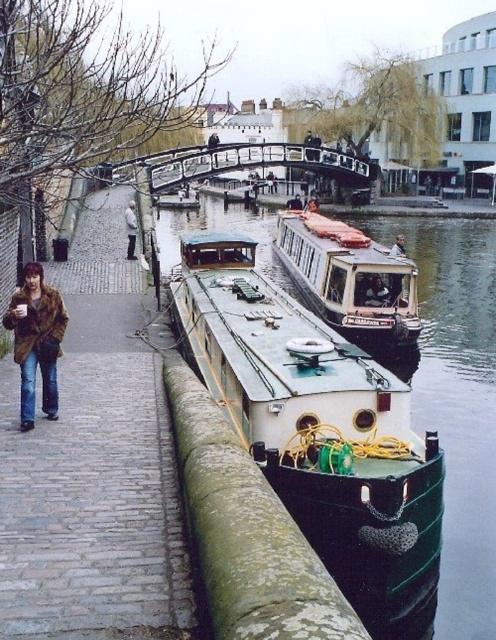
Does green rubber boat at lower left appear under green matte boat at center?

Yes.

Is point (159, 413) farther from viewer compared to point (299, 512)?

Yes, point (159, 413) is farther from viewer.

At what (x,y) coordinates should I click in order to perform the action: click on green rubber boat at lower left. Please return your answer as a coordinate pair (x, y). The width and height of the screenshot is (496, 640). Looking at the image, I should click on (95, 465).

You are a GUI agent. You are given a task and a screenshot of the screen. Output one action in this format:
    pyautogui.click(x=<x>, y=<y>)
    Task: Click on the green rubber boat at lower left
    This screenshot has width=496, height=640.
    Given the screenshot: What is the action you would take?
    pyautogui.click(x=95, y=465)

Between brown fur coat at left and light brown fur coat at left, which one appears on the left side from the viewer's perspective?

light brown fur coat at left

Is point (55, 344) in front of point (134, 218)?

Yes.

Describe the element at coordinates (37, 340) in the screenshot. Image resolution: width=496 pixels, height=640 pixels. I see `brown fur coat at left` at that location.

Locate an element on the screen. This screenshot has width=496, height=640. brown fur coat at left is located at coordinates (37, 340).

Is green rubber boat at lower left bigger than light brown fur coat at left?

Correct, green rubber boat at lower left is larger in size than light brown fur coat at left.

Does green rubber boat at lower left have a lesser width compared to light brown fur coat at left?

No.

Measure the distance between point (99, 518) and camera.

Point (99, 518) and camera are 22.29 meters apart.

This screenshot has height=640, width=496. Find the location of `green rubber boat at lower left`. green rubber boat at lower left is located at coordinates (95, 465).